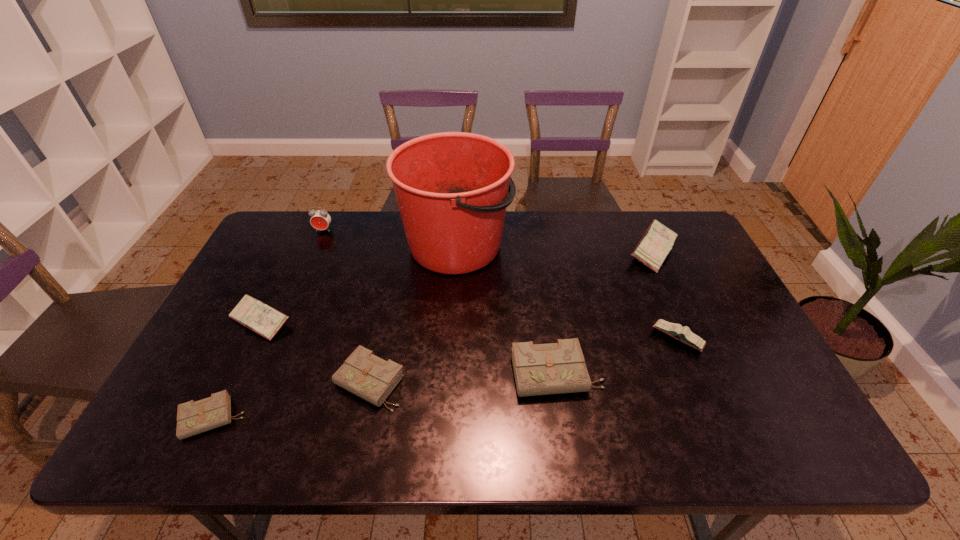
I want to click on vacant area between the farthest pink diary and the bucket, so click(x=555, y=247).

At what (x,y) coordinates should I click in order to perform the action: click on vacant space in between the smallest pink diary and the pink bucket. Please return your answer as a coordinate pair (x, y). This screenshot has width=960, height=540. Looking at the image, I should click on (567, 292).

I want to click on free space between the second tallest object and the pink bucket, so click(390, 238).

At what (x,y) coordinates should I click in order to perform the action: click on vacant point located between the smallest pink diary and the biggest pink diary. Please return your answer as a coordinate pair (x, y). The height and width of the screenshot is (540, 960). Looking at the image, I should click on (665, 294).

Select which object is the fourth closest to the fourth diary from right to left. Please provide its 2D coordinates. Your answer should be formatted as a tuple, i.e. [(x, y)], where the tuple contains the x and y coordinates of a point satisfying the conditions above.

[(555, 368)]

Choose which object is the sixth nearest neighbor to the bucket. Please provide its 2D coordinates. Your answer should be formatted as a tuple, i.e. [(x, y)], where the tuple contains the x and y coordinates of a point satisfying the conditions above.

[(684, 334)]

Choose which diary is the fifth nearest neighbor to the second biggest green diary. Please provide its 2D coordinates. Your answer should be formatted as a tuple, i.e. [(x, y)], where the tuple contains the x and y coordinates of a point satisfying the conditions above.

[(652, 249)]

Locate an element on the screen. diary that stands as the closest to the rightmost green diary is located at coordinates (684, 334).

Find the location of `pink diary that stands as the third closest to the pink bucket`. pink diary that stands as the third closest to the pink bucket is located at coordinates (684, 334).

You are a GUI agent. You are given a task and a screenshot of the screen. Output one action in this format:
    pyautogui.click(x=<x>, y=<y>)
    Task: Click on the pink diary identified as the closest to the third diary from left to right
    The height and width of the screenshot is (540, 960).
    Given the screenshot: What is the action you would take?
    pyautogui.click(x=266, y=321)